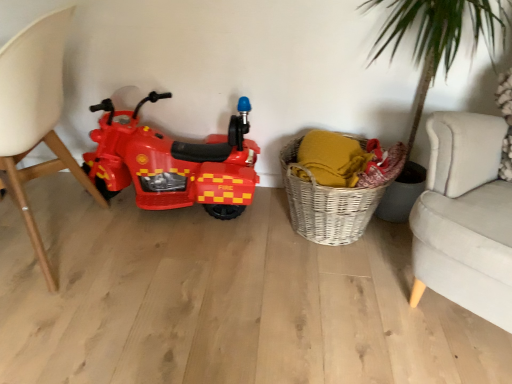
At what (x,y) coordinates should I click in order to perform the action: click on vacant space in between shiny plastic toy motorcycle at left and woven wicker basket at lower right. Please return your answer as a coordinate pair (x, y). Looking at the image, I should click on (233, 223).